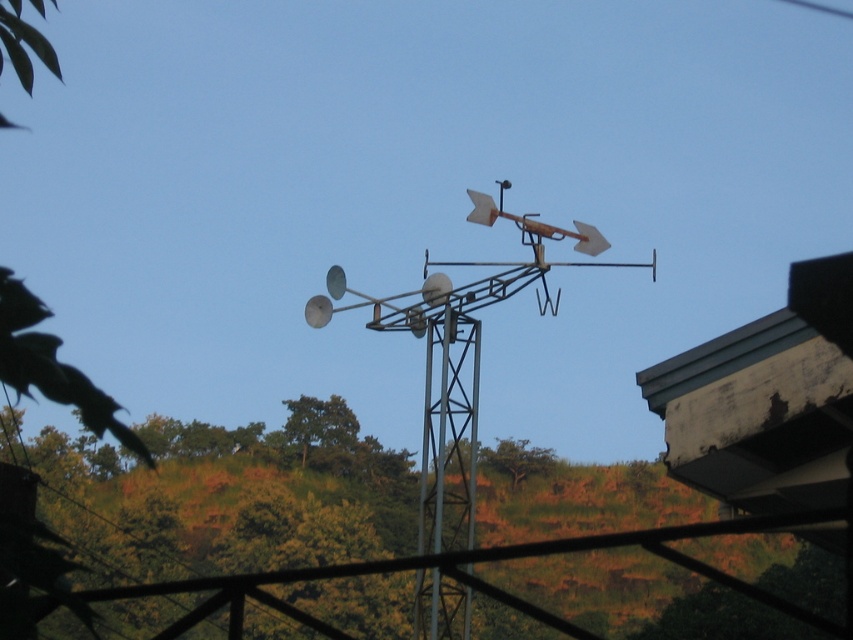
Question: Can you confirm if metallic silver vane at center is bigger than metallic gray pole at center?

Choices:
 (A) yes
 (B) no

Answer: (A)

Question: Which point appears closest to the camera in this image?

Choices:
 (A) (426, 548)
 (B) (421, 632)

Answer: (B)

Question: Does metallic silver vane at center have a smaller size compared to metallic gray pole at center?

Choices:
 (A) yes
 (B) no

Answer: (B)

Question: Is metallic silver vane at center bigger than metallic gray pole at center?

Choices:
 (A) no
 (B) yes

Answer: (B)

Question: Which point is farther to the camera?

Choices:
 (A) metallic silver vane at center
 (B) metallic gray pole at center

Answer: (B)